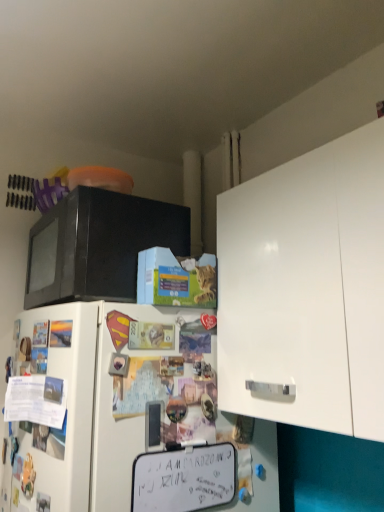
Question: Can you confirm if white matte dry erase board at lower center is wider than white matte cabinet at upper right?

Choices:
 (A) yes
 (B) no

Answer: (B)

Question: Is white matte dry erase board at lower center not near white matte cabinet at upper right?

Choices:
 (A) yes
 (B) no

Answer: (B)

Question: Can you confirm if white matte dry erase board at lower center is taller than white matte cabinet at upper right?

Choices:
 (A) yes
 (B) no

Answer: (B)

Question: Considering the relative positions of white matte dry erase board at lower center and white matte cabinet at upper right in the image provided, is white matte dry erase board at lower center to the left of white matte cabinet at upper right from the viewer's perspective?

Choices:
 (A) no
 (B) yes

Answer: (B)

Question: Does white matte dry erase board at lower center turn towards white matte cabinet at upper right?

Choices:
 (A) yes
 (B) no

Answer: (B)

Question: Does white matte dry erase board at lower center have a lesser width compared to white matte cabinet at upper right?

Choices:
 (A) yes
 (B) no

Answer: (A)

Question: Would you consider black matte microwave at upper left to be distant from white matte cabinet at upper right?

Choices:
 (A) no
 (B) yes

Answer: (A)

Question: Does black matte microwave at upper left have a smaller size compared to white matte cabinet at upper right?

Choices:
 (A) yes
 (B) no

Answer: (A)

Question: From a real-world perspective, is black matte microwave at upper left on top of white matte cabinet at upper right?

Choices:
 (A) no
 (B) yes

Answer: (B)

Question: Considering the relative sizes of black matte microwave at upper left and white matte cabinet at upper right in the image provided, is black matte microwave at upper left bigger than white matte cabinet at upper right?

Choices:
 (A) yes
 (B) no

Answer: (B)

Question: Considering the relative positions of black matte microwave at upper left and white matte cabinet at upper right in the image provided, is black matte microwave at upper left to the left of white matte cabinet at upper right from the viewer's perspective?

Choices:
 (A) yes
 (B) no

Answer: (A)

Question: Considering the relative sizes of black matte microwave at upper left and white matte cabinet at upper right in the image provided, is black matte microwave at upper left thinner than white matte cabinet at upper right?

Choices:
 (A) no
 (B) yes

Answer: (A)

Question: Considering the relative sizes of black matte microwave at upper left and white matte refrigerator at lower left in the image provided, is black matte microwave at upper left thinner than white matte refrigerator at lower left?

Choices:
 (A) yes
 (B) no

Answer: (A)